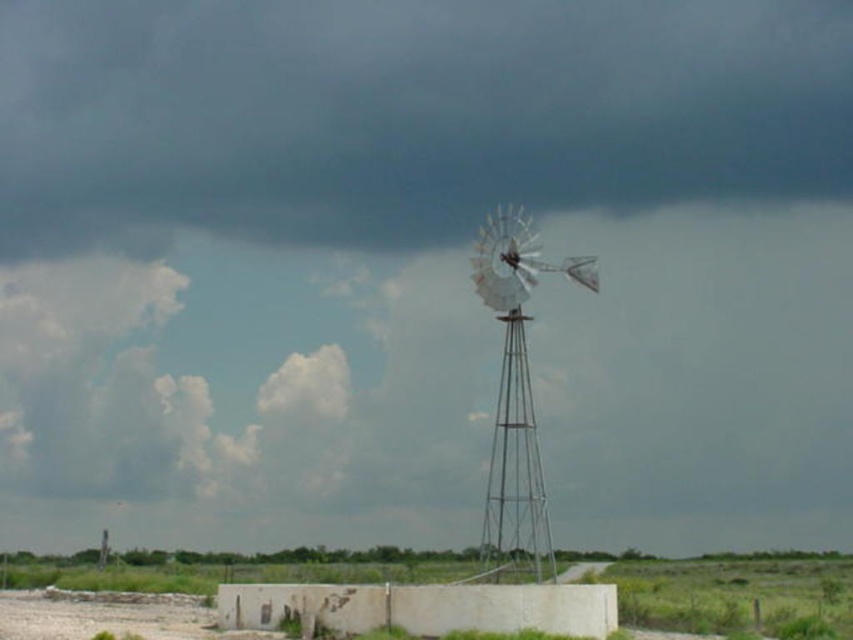
Can you confirm if cloudy sky at upper center is thinner than metallic silver windmill at center?

Incorrect, cloudy sky at upper center's width is not less than metallic silver windmill at center's.

Where is `cloudy sky at upper center`? The width and height of the screenshot is (853, 640). cloudy sky at upper center is located at coordinates (242, 401).